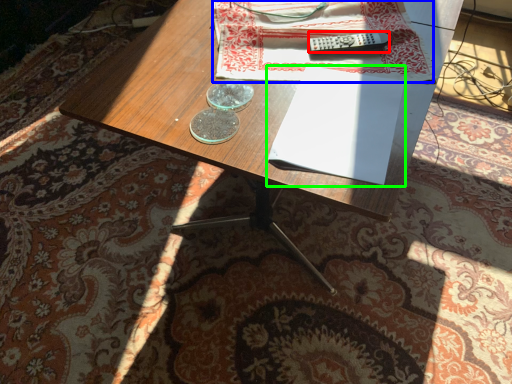
Question: Estimate the real-world distances between objects in this image. Which object is farther from remote control (highlighted by a red box), sheet (highlighted by a blue box) or paperback book (highlighted by a green box)?

Choices:
 (A) sheet
 (B) paperback book

Answer: (B)